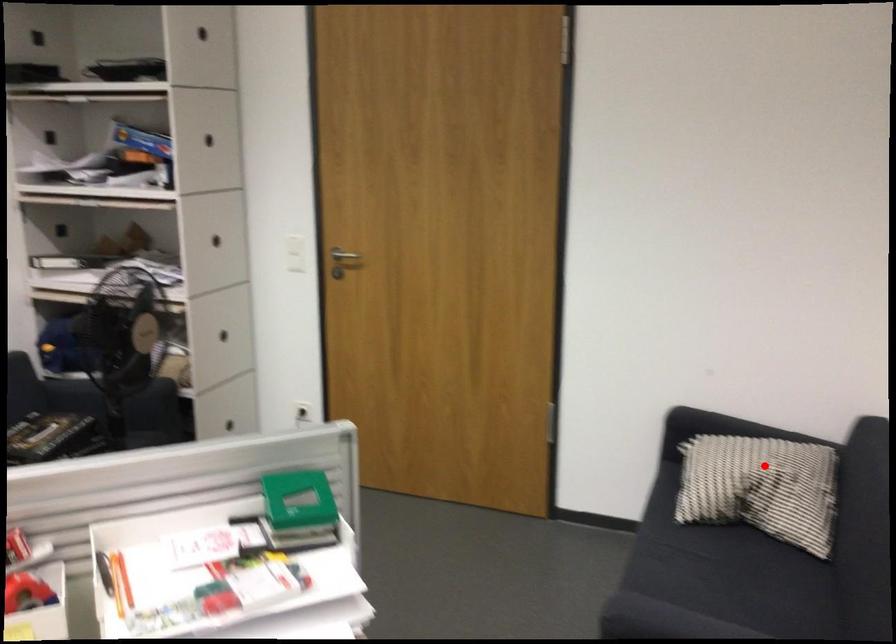
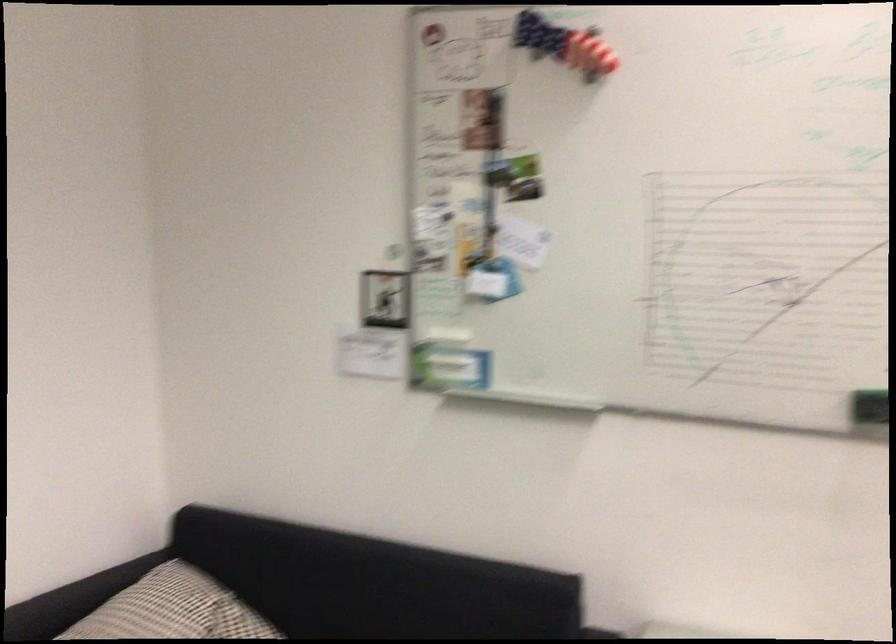
Question: A red point is marked in image1. In image2, is the corresponding 3D point closer to the camera or farther? Reply with the corresponding letter.

Choices:
 (A) The corresponding 3D point is closer.
 (B) The corresponding 3D point is farther.

Answer: (A)